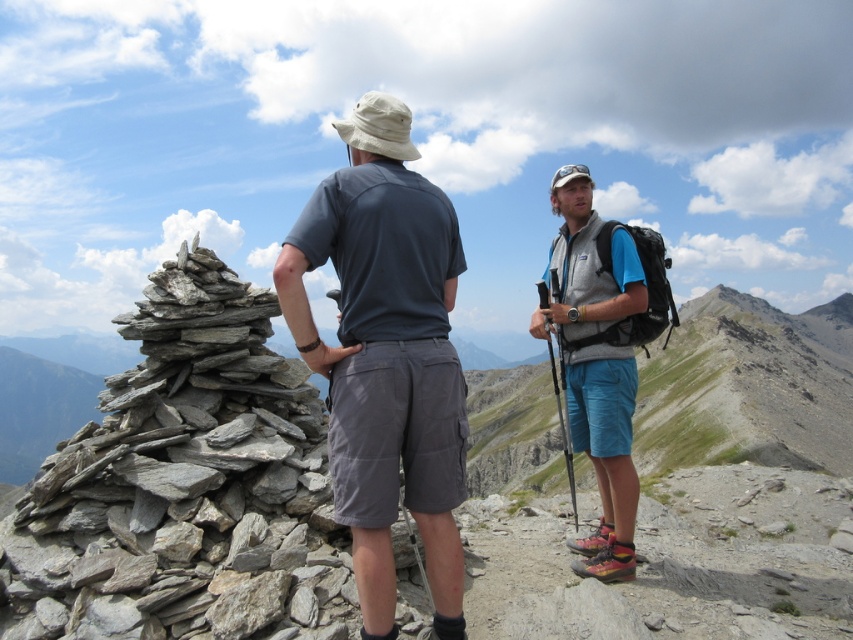
You are planning to take a photo of the gray stone cairn at left and the matte gray vest at center. Which object should you focus on first if you want to capture both in a single frame without moving the camera? Explain your reasoning based on their sizes.

The gray stone cairn at left is larger than the matte gray vest at center. To include both in a single frame, focus on the larger object first, which is the gray stone cairn at left, as it occupies more space and will require adjusting the camera angle or zoom to fit the smaller matte gray vest at center into the frame.

You are a photographer trying to capture both the gray fabric shirt at center and the matte gray vest at center in the same frame. Since you want to highlight their positions, which one is located to the left of the other?

The gray fabric shirt at center is positioned on the left side of matte gray vest at center.

You are planning to take a photo of the gray stone cairn at left and the matte gray vest at center from a viewpoint that is higher than both objects. Based on their positions, which object should you position closer to the bottom of the frame to ensure they are both fully visible in the photo?

The gray stone cairn at left is located below the matte gray vest at center. To ensure both are fully visible, position the gray stone cairn at left closer to the bottom of the frame since it is lower in elevation compared to the matte gray vest at center.